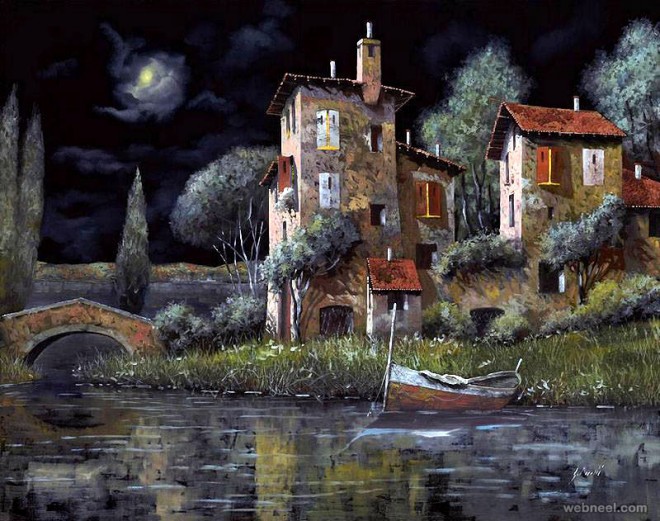
Find the location of `chimney`. chimney is located at coordinates (371, 60), (331, 58), (575, 96), (408, 134), (435, 148), (639, 161).